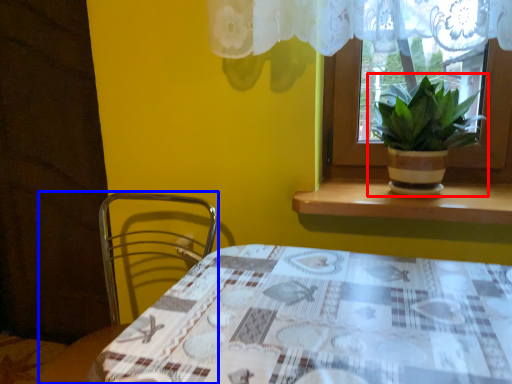
Question: Which object appears closest to the camera in this image, houseplant (highlighted by a red box) or chair (highlighted by a blue box)?

Choices:
 (A) houseplant
 (B) chair

Answer: (B)